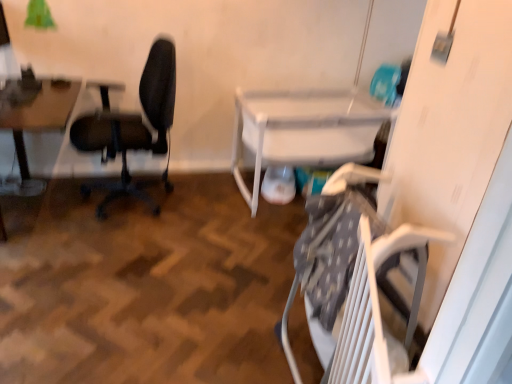
Question: Is wooden table at left, which appears as the 2th table when viewed from the right, to the right of white plastic table at lower right, which is counted as the first table, starting from the right, from the viewer's perspective?

Choices:
 (A) yes
 (B) no

Answer: (B)

Question: From a real-world perspective, is wooden table at left, which appears as the 2th table when viewed from the right, on white plastic table at lower right, which appears as the 2th table when viewed from the left?

Choices:
 (A) yes
 (B) no

Answer: (A)

Question: Can we say wooden table at left, arranged as the first table when viewed from the left, lies outside white plastic table at lower right, which appears as the 2th table when viewed from the left?

Choices:
 (A) no
 (B) yes

Answer: (B)

Question: Would you say white plastic table at lower right, which appears as the 2th table when viewed from the left, is part of wooden table at left, which appears as the 2th table when viewed from the right,'s contents?

Choices:
 (A) yes
 (B) no

Answer: (B)

Question: Does wooden table at left, arranged as the first table when viewed from the left, have a smaller size compared to white plastic table at lower right, which is counted as the first table, starting from the right?

Choices:
 (A) yes
 (B) no

Answer: (A)

Question: From the image's perspective, is white plastic table at lower right, which is counted as the first table, starting from the right, above or below black matte office chair at left?

Choices:
 (A) below
 (B) above

Answer: (A)

Question: Is white plastic table at lower right, which appears as the 2th table when viewed from the left, situated inside black matte office chair at left or outside?

Choices:
 (A) outside
 (B) inside

Answer: (A)

Question: Considering the positions of white plastic table at lower right, which is counted as the first table, starting from the right, and black matte office chair at left in the image, is white plastic table at lower right, which is counted as the first table, starting from the right, taller or shorter than black matte office chair at left?

Choices:
 (A) tall
 (B) short

Answer: (B)

Question: In terms of width, does white plastic table at lower right, which is counted as the first table, starting from the right, look wider or thinner when compared to black matte office chair at left?

Choices:
 (A) wide
 (B) thin

Answer: (A)

Question: In terms of width, does black matte office chair at left look wider or thinner when compared to white plastic table at lower right, which appears as the 2th table when viewed from the left?

Choices:
 (A) thin
 (B) wide

Answer: (A)

Question: From the image's perspective, is black matte office chair at left positioned above or below white plastic table at lower right, which appears as the 2th table when viewed from the left?

Choices:
 (A) above
 (B) below

Answer: (A)

Question: Is point (159, 77) positioned closer to the camera than point (317, 165)?

Choices:
 (A) closer
 (B) farther

Answer: (A)

Question: Is black matte office chair at left taller or shorter than white plastic table at lower right, which is counted as the first table, starting from the right?

Choices:
 (A) tall
 (B) short

Answer: (A)

Question: Is wooden table at left, which appears as the 2th table when viewed from the right, inside the boundaries of black matte office chair at left, or outside?

Choices:
 (A) outside
 (B) inside

Answer: (A)

Question: Based on their positions, is wooden table at left, arranged as the first table when viewed from the left, located to the left or right of black matte office chair at left?

Choices:
 (A) right
 (B) left

Answer: (B)